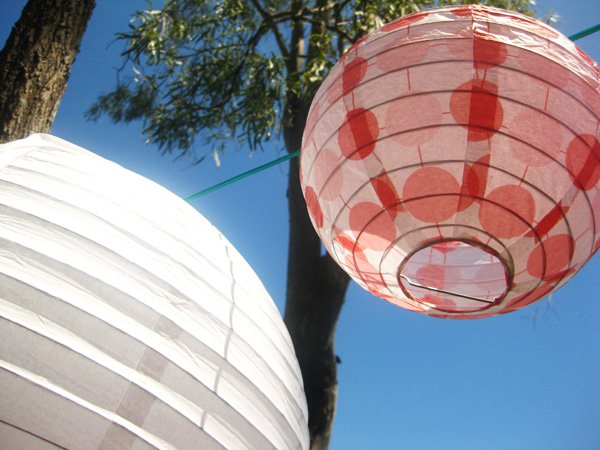
The height and width of the screenshot is (450, 600). In order to click on red and pink patterned lantern in this screenshot , I will do `click(473, 98)`.